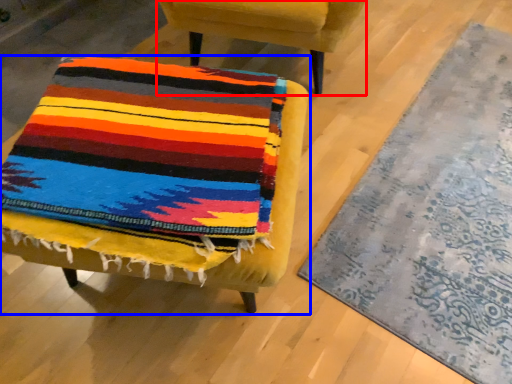
Question: Which object appears farthest to the camera in this image, chair (highlighted by a red box) or chair (highlighted by a blue box)?

Choices:
 (A) chair
 (B) chair

Answer: (A)